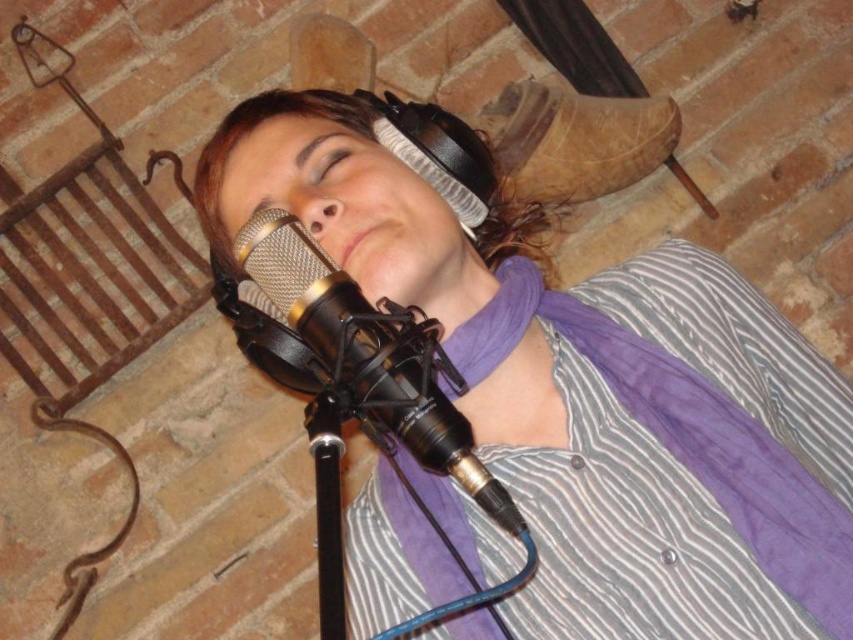
Question: Is matte black headphones at center smaller than black metallic microphone at center?

Choices:
 (A) no
 (B) yes

Answer: (A)

Question: In this image, where is matte black headphones at center located relative to black metallic microphone at center?

Choices:
 (A) left
 (B) right

Answer: (B)

Question: Is matte black headphones at center bigger than black metallic microphone at center?

Choices:
 (A) yes
 (B) no

Answer: (A)

Question: Which point is farther to the camera?

Choices:
 (A) black metallic microphone at center
 (B) matte black headphones at center

Answer: (B)

Question: Which of the following is the closest to the observer?

Choices:
 (A) matte black headphones at center
 (B) black metallic microphone at center

Answer: (B)